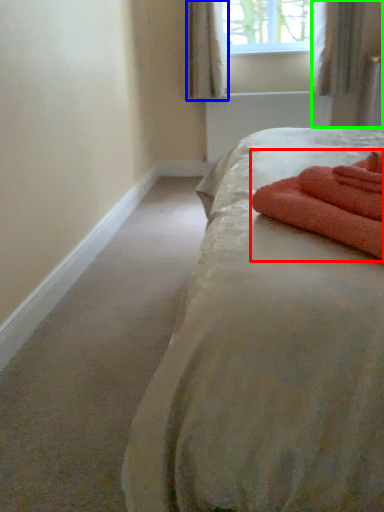
Question: Based on their relative distances, which object is farther from bath towel (highlighted by a red box)? Choose from curtain (highlighted by a blue box) and curtain (highlighted by a green box).

Choices:
 (A) curtain
 (B) curtain

Answer: (A)